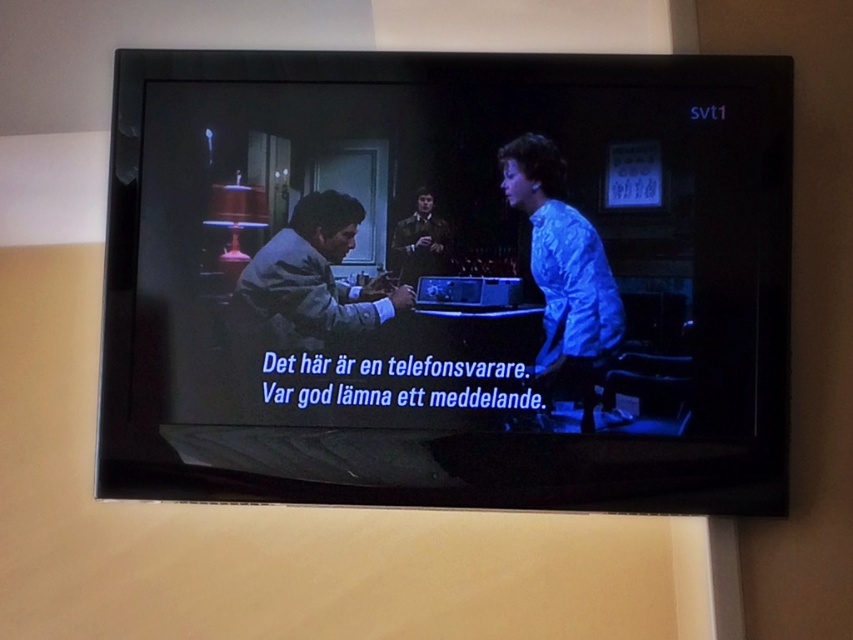
Where is `matte black television at center`? The image size is (853, 640). matte black television at center is located at coordinates (450, 280).

Based on the photo, who is lower down, matte black television at center or gray fabric shirt at center?

matte black television at center

Is point (386, 120) farther from camera compared to point (297, 234)?

No, it is in front of (297, 234).

The width and height of the screenshot is (853, 640). In order to click on matte black television at center in this screenshot , I will do `click(450, 280)`.

Can you confirm if matte black television at center is shorter than blue satin blouse at center?

No.

Does point (584, 195) come behind point (585, 316)?

Yes, point (584, 195) is farther from viewer.

Find the location of a particular element. This screenshot has height=640, width=853. matte black television at center is located at coordinates (450, 280).

Is point (561, 333) positioned before point (283, 248)?

That is True.

This screenshot has width=853, height=640. I want to click on blue satin blouse at center, so click(563, 273).

Is point (553, 177) more distant than point (331, 230)?

No, (553, 177) is closer to viewer.

Where is `blue satin blouse at center`? blue satin blouse at center is located at coordinates (563, 273).